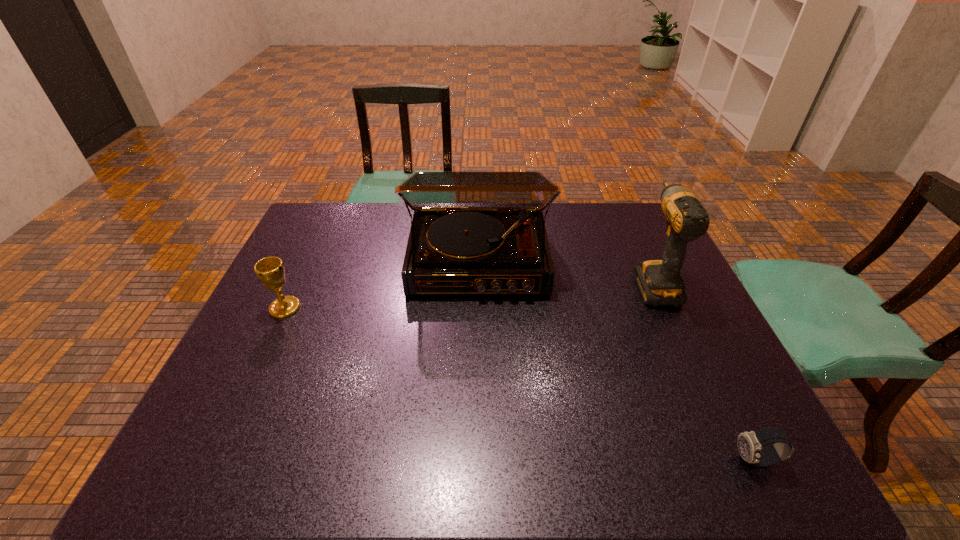
At what (x,y) coordinates should I click in order to perform the action: click on record player. Please return your answer as a coordinate pair (x, y). Looking at the image, I should click on (473, 232).

Identify the location of drill. The height and width of the screenshot is (540, 960). (660, 283).

Where is `chalice`? Image resolution: width=960 pixels, height=540 pixels. chalice is located at coordinates (270, 270).

Where is `the leftmost object`? the leftmost object is located at coordinates (270, 270).

At what (x,y) coordinates should I click in order to perform the action: click on the nearest object. Please return your answer as a coordinate pair (x, y). This screenshot has width=960, height=540. Looking at the image, I should click on (750, 444).

The image size is (960, 540). I want to click on watch, so [x=750, y=444].

The width and height of the screenshot is (960, 540). Identify the location of free space located 0.060m on the front-facing side of the record player. (478, 318).

Locate an element on the screen. The image size is (960, 540). vacant area located 0.250m with the drill bit of the drill facing forward is located at coordinates (622, 211).

Identify the location of vacant region located with the drill bit of the drill facing forward. (619, 205).

The height and width of the screenshot is (540, 960). I want to click on vacant space situated with the drill bit of the drill facing forward, so click(x=635, y=240).